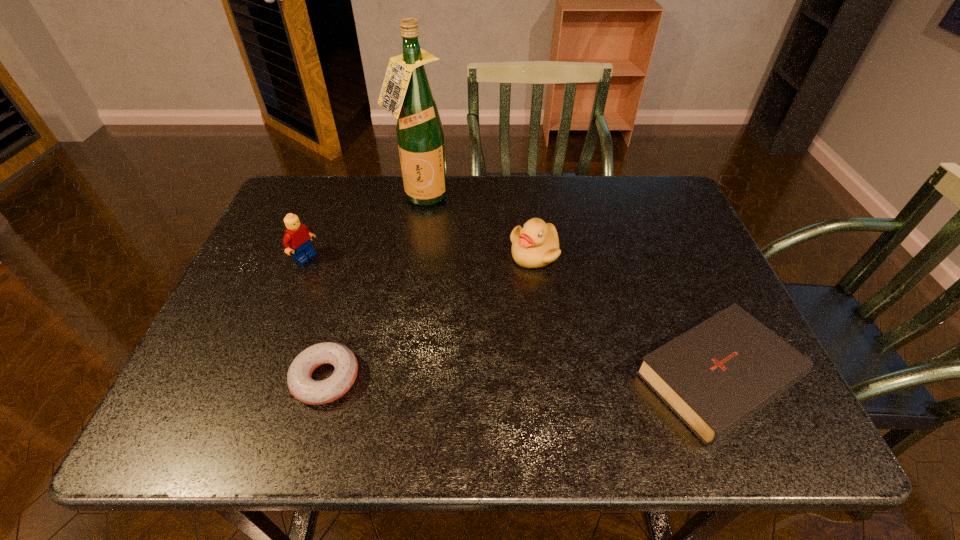
This screenshot has height=540, width=960. I want to click on object that is at the far edge, so click(x=406, y=93).

Find the location of `doughnut that is at the near edge`. doughnut that is at the near edge is located at coordinates (300, 383).

Identify the location of Bible located at the near edge. Image resolution: width=960 pixels, height=540 pixels. (715, 376).

In order to click on object situated at the left edge in this screenshot , I will do `click(298, 236)`.

The image size is (960, 540). Identify the location of object that is at the right edge. (715, 376).

At what (x,y) coordinates should I click in order to perform the action: click on object located at the near right corner. Please return your answer as a coordinate pair (x, y). Looking at the image, I should click on (715, 376).

What are the coordinates of `vacant region at the far edge of the desktop` in the screenshot? It's located at (489, 210).

The image size is (960, 540). In order to click on free space at the near edge of the desktop in this screenshot , I will do `click(634, 395)`.

The width and height of the screenshot is (960, 540). Identify the location of free space at the left edge. (324, 229).

Where is `free space at the right edge of the desktop`? free space at the right edge of the desktop is located at coordinates (677, 269).